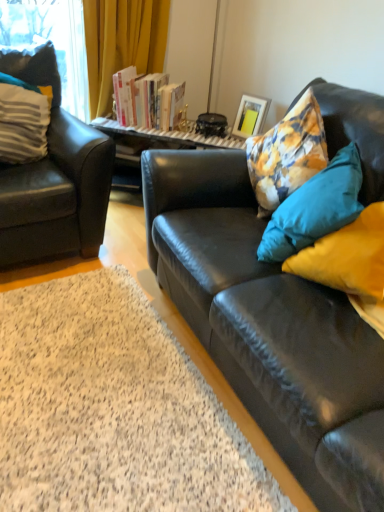
Question: Can you confirm if matte black armchair at left is shorter than black leather couch at right?

Choices:
 (A) yes
 (B) no

Answer: (B)

Question: Considering the relative positions of matte black armchair at left and black leather couch at right in the image provided, is matte black armchair at left to the left of black leather couch at right from the viewer's perspective?

Choices:
 (A) yes
 (B) no

Answer: (A)

Question: Is matte black armchair at left turned away from black leather couch at right?

Choices:
 (A) no
 (B) yes

Answer: (A)

Question: Considering the relative sizes of matte black armchair at left and black leather couch at right in the image provided, is matte black armchair at left taller than black leather couch at right?

Choices:
 (A) yes
 (B) no

Answer: (A)

Question: Is the depth of matte black armchair at left greater than that of black leather couch at right?

Choices:
 (A) no
 (B) yes

Answer: (B)

Question: Is matte black armchair at left inside the boundaries of black leather couch at right, or outside?

Choices:
 (A) inside
 (B) outside

Answer: (B)

Question: Relative to black leather couch at right, is matte black armchair at left in front or behind?

Choices:
 (A) behind
 (B) front

Answer: (A)

Question: From a real-world perspective, relative to black leather couch at right, is matte black armchair at left vertically above or below?

Choices:
 (A) above
 (B) below

Answer: (A)

Question: Looking at their shapes, would you say matte black armchair at left is wider or thinner than black leather couch at right?

Choices:
 (A) thin
 (B) wide

Answer: (A)

Question: Based on their sizes in the image, would you say black leather couch at right is bigger or smaller than hardcover books at center?

Choices:
 (A) small
 (B) big

Answer: (B)

Question: Is black leather couch at right spatially inside hardcover books at center, or outside of it?

Choices:
 (A) inside
 (B) outside

Answer: (B)

Question: In terms of height, does black leather couch at right look taller or shorter compared to hardcover books at center?

Choices:
 (A) short
 (B) tall

Answer: (A)

Question: In terms of width, does black leather couch at right look wider or thinner when compared to hardcover books at center?

Choices:
 (A) thin
 (B) wide

Answer: (B)

Question: Looking at their shapes, would you say hardcover books at center is wider or thinner than floral fabric cushion at right, which ranks as the first pillow in right-to-left order?

Choices:
 (A) thin
 (B) wide

Answer: (A)

Question: Does point (163, 104) appear closer or farther from the camera than point (284, 223)?

Choices:
 (A) farther
 (B) closer

Answer: (A)